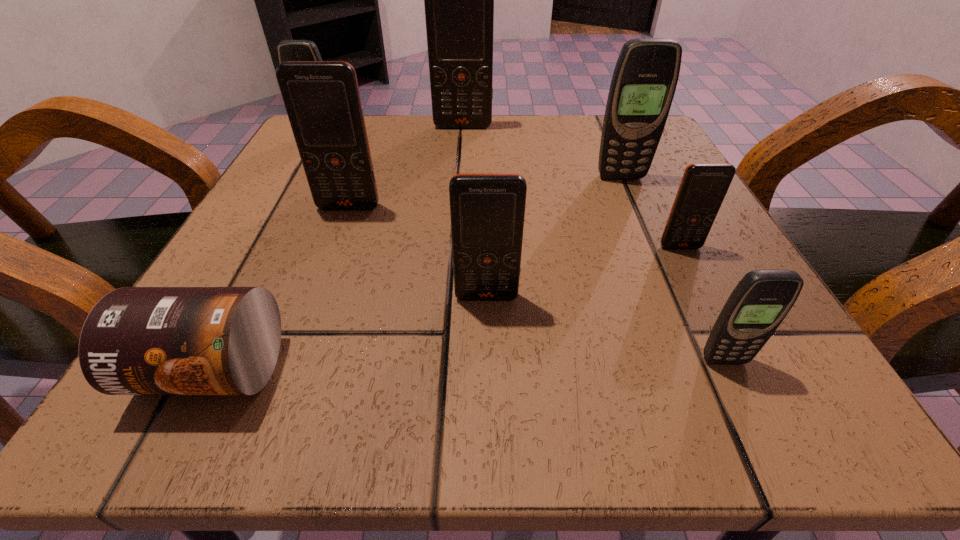
The width and height of the screenshot is (960, 540). In order to click on free space at the left edge in this screenshot , I will do `click(277, 291)`.

Where is `vacant space at the right edge of the desktop`? vacant space at the right edge of the desktop is located at coordinates (653, 312).

Where is `vacant region at the near left corner of the desktop`? This screenshot has width=960, height=540. vacant region at the near left corner of the desktop is located at coordinates (283, 356).

At what (x,y) coordinates should I click in order to perform the action: click on vacant region at the far right corner of the desktop. Please return your answer as a coordinate pair (x, y). Looking at the image, I should click on (588, 142).

Find the location of a particular element. This screenshot has width=960, height=540. vacant region at the near right corner of the desktop is located at coordinates (710, 409).

Where is `vacant area that lies between the shortest object and the smallest orange cellular telephone`? The height and width of the screenshot is (540, 960). vacant area that lies between the shortest object and the smallest orange cellular telephone is located at coordinates (446, 308).

You are a GUI agent. You are given a task and a screenshot of the screen. Output one action in this format:
    pyautogui.click(x=<x>, y=<y>)
    Task: Click on the vacant space that's between the second nearest gray cellular telephone and the can
    This screenshot has width=960, height=540.
    Given the screenshot: What is the action you would take?
    pyautogui.click(x=417, y=273)

Identify the location of free space that is in between the tallest cellular telephone and the second nearest gray cellular telephone. Image resolution: width=960 pixels, height=540 pixels. (541, 152).

At what (x,y) coordinates should I click in order to perform the action: click on vacant region between the fifth farthest object and the second nearest gray cellular telephone. Please return your answer as a coordinate pair (x, y). Looking at the image, I should click on (650, 212).

Find the location of `vacant area that lies between the farthest orange cellular telephone and the second farthest cellular telephone`. vacant area that lies between the farthest orange cellular telephone and the second farthest cellular telephone is located at coordinates (392, 132).